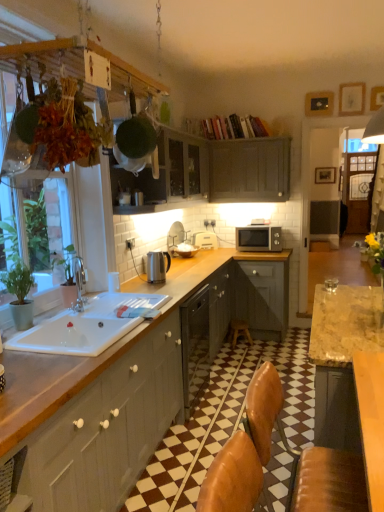
The image size is (384, 512). What are the coordinates of `empty space that is ontop of white ceramic sink at lower left (from a real-world perspective)` in the screenshot? It's located at (117, 310).